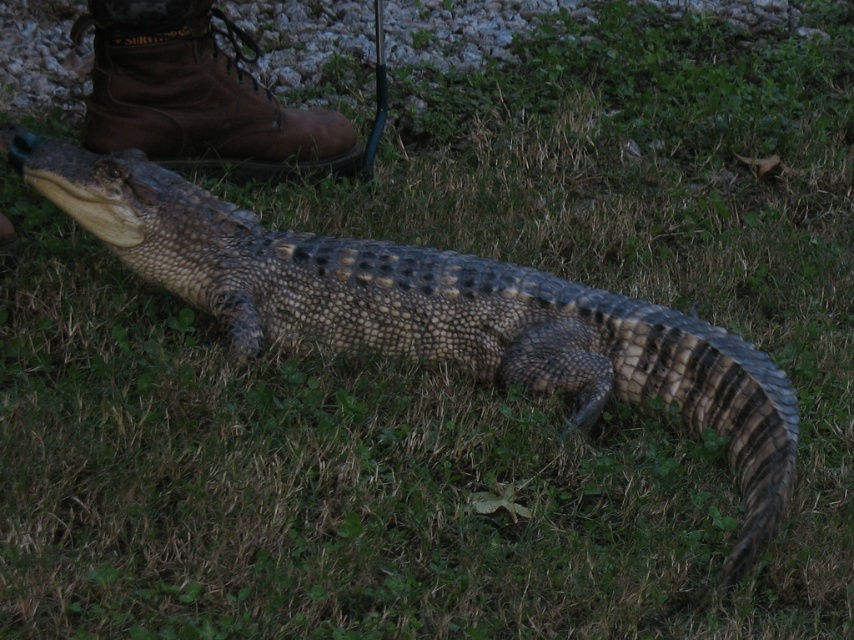
Question: Which object appears closest to the camera in this image?

Choices:
 (A) scaly brown crocodile at center
 (B) brown leather boot at upper left

Answer: (A)

Question: Which object is farther from the camera taking this photo?

Choices:
 (A) brown leather boot at upper left
 (B) scaly brown crocodile at center

Answer: (A)

Question: In this image, where is scaly brown crocodile at center located relative to brown leather boot at upper left?

Choices:
 (A) right
 (B) left

Answer: (A)

Question: Is scaly brown crocodile at center below brown leather boot at upper left?

Choices:
 (A) yes
 (B) no

Answer: (A)

Question: Can you confirm if scaly brown crocodile at center is bigger than brown leather boot at upper left?

Choices:
 (A) no
 (B) yes

Answer: (B)